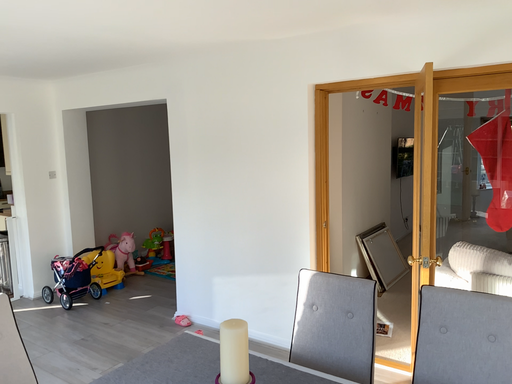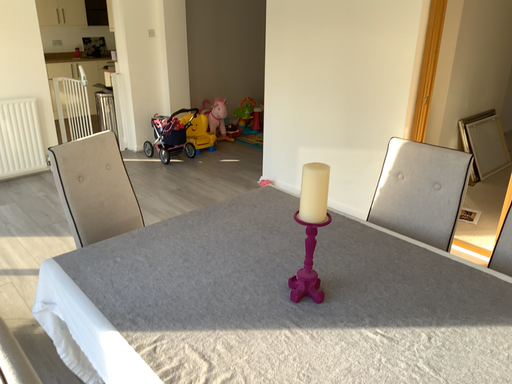
Question: Which way did the camera rotate in the video?

Choices:
 (A) rotated upward
 (B) rotated downward

Answer: (B)